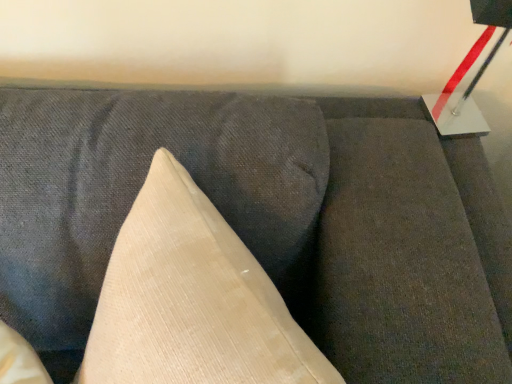
You are a GUI agent. You are given a task and a screenshot of the screen. Output one action in this format:
    pyautogui.click(x=<x>, y=<y>)
    Task: Click on the beige fabric pillow at center
    Image resolution: width=512 pixels, height=384 pixels.
    Given the screenshot: What is the action you would take?
    pyautogui.click(x=191, y=300)

What do you see at coordinates (191, 300) in the screenshot? I see `beige fabric pillow at center` at bounding box center [191, 300].

At what (x,y) coordinates should I click in order to perform the action: click on beige fabric pillow at center. Please return your answer as a coordinate pair (x, y). Image resolution: width=512 pixels, height=384 pixels. Looking at the image, I should click on (191, 300).